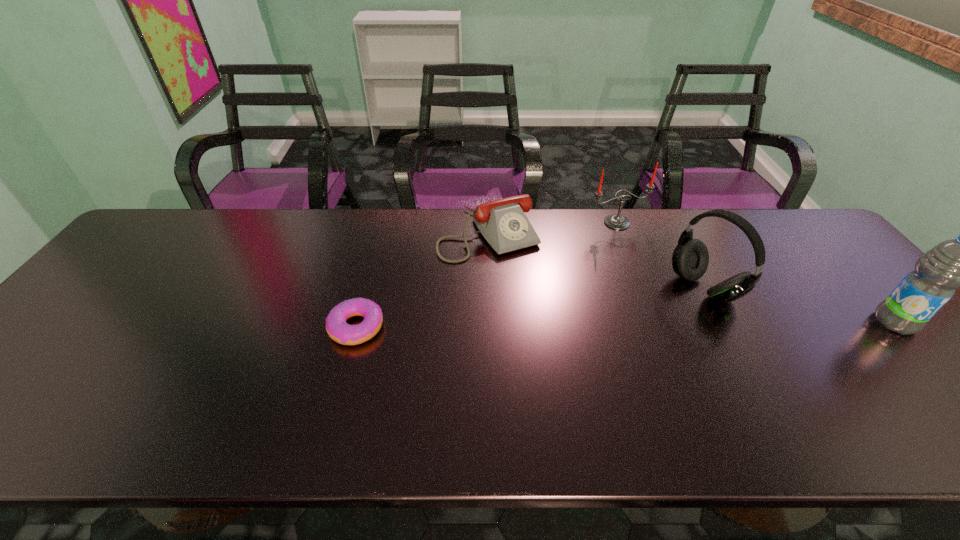
Identify the location of vacant region between the second object from left to right and the leftmost object. (422, 281).

Find the location of a particular element. This screenshot has width=960, height=540. free space between the telephone and the headset is located at coordinates (596, 261).

Image resolution: width=960 pixels, height=540 pixels. Find the location of `the second closest object to the headset`. the second closest object to the headset is located at coordinates (958, 263).

Where is `the third closest object relative to the headset`? This screenshot has height=540, width=960. the third closest object relative to the headset is located at coordinates (503, 223).